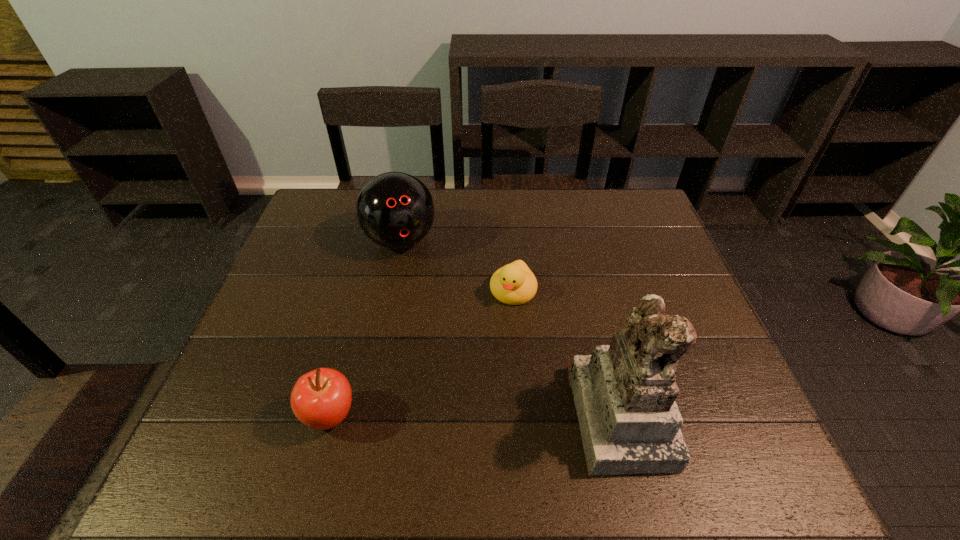
Find the location of `free spot between the second tallest object and the apple`. free spot between the second tallest object and the apple is located at coordinates (366, 328).

I want to click on free space between the apple and the farthest object, so click(x=366, y=328).

Where is `vacant space in between the third object from left to right and the tallest object`? This screenshot has height=540, width=960. vacant space in between the third object from left to right and the tallest object is located at coordinates (566, 352).

The height and width of the screenshot is (540, 960). I want to click on unoccupied area between the figurine and the second object from right to left, so click(566, 352).

The image size is (960, 540). What are the coordinates of `unoccupied area between the shortest object and the rightmost object` in the screenshot? It's located at (566, 352).

Locate an element on the screen. unoccupied position between the tallest object and the shortest object is located at coordinates (566, 352).

Identify which object is the second nearest to the figurine. Please provide its 2D coordinates. Your answer should be formatted as a tuple, i.e. [(x, y)], where the tuple contains the x and y coordinates of a point satisfying the conditions above.

[(321, 399)]

Find the location of a particular element. object that stands as the second closest to the farthest object is located at coordinates (321, 399).

Identify the location of free space that satisfies the following two spatial constraints: 1. on the front side of the third object from left to right; 2. on the right side of the second tallest object. (391, 291).

Find the location of `free space that satisfies the following two spatial constraints: 1. on the back side of the tallest object; 2. on the front-facing side of the third tallest object`. free space that satisfies the following two spatial constraints: 1. on the back side of the tallest object; 2. on the front-facing side of the third tallest object is located at coordinates (331, 414).